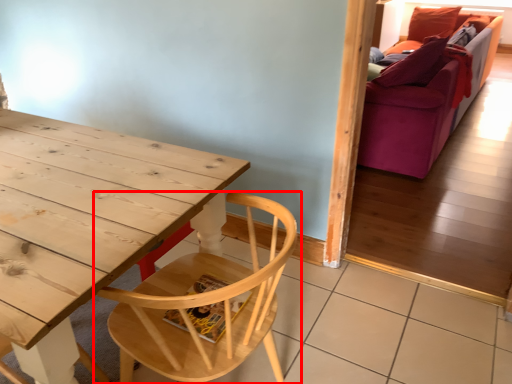
Question: In this image, where is chair (annotated by the red box) located relative to studio couch?

Choices:
 (A) right
 (B) left

Answer: (B)